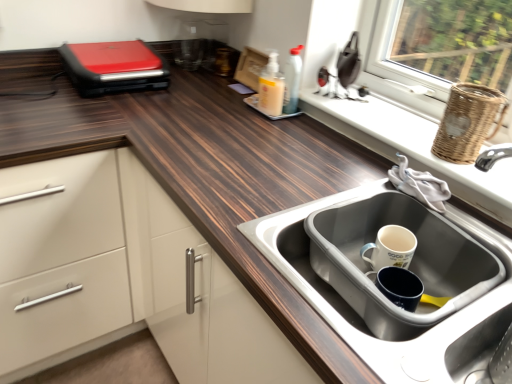
Question: From the image's perspective, is translucent plastic soap dispenser at center located above stainless steel sink at lower right?

Choices:
 (A) no
 (B) yes

Answer: (B)

Question: Are translucent plastic soap dispenser at center and stainless steel sink at lower right located far from each other?

Choices:
 (A) yes
 (B) no

Answer: (B)

Question: Is translucent plastic soap dispenser at center bigger than stainless steel sink at lower right?

Choices:
 (A) no
 (B) yes

Answer: (A)

Question: Is translucent plastic soap dispenser at center looking in the opposite direction of stainless steel sink at lower right?

Choices:
 (A) no
 (B) yes

Answer: (A)

Question: Does translucent plastic soap dispenser at center appear on the right side of stainless steel sink at lower right?

Choices:
 (A) yes
 (B) no

Answer: (B)

Question: From the image's perspective, is white wicker basket at right above or below white matte mug at sink?

Choices:
 (A) above
 (B) below

Answer: (A)

Question: Would you say white wicker basket at right is inside or outside white matte mug at sink?

Choices:
 (A) outside
 (B) inside

Answer: (A)

Question: Is point (487, 208) positioned closer to the camera than point (389, 251)?

Choices:
 (A) farther
 (B) closer

Answer: (A)

Question: Considering the relative positions of white wicker basket at right and white matte mug at sink in the image provided, is white wicker basket at right to the left or to the right of white matte mug at sink?

Choices:
 (A) right
 (B) left

Answer: (A)

Question: In terms of width, does stainless steel sink at lower right look wider or thinner when compared to translucent plastic soap dispenser at center?

Choices:
 (A) thin
 (B) wide

Answer: (B)

Question: From the image's perspective, is stainless steel sink at lower right above or below translucent plastic soap dispenser at center?

Choices:
 (A) above
 (B) below

Answer: (B)

Question: In the image, is stainless steel sink at lower right positioned in front of or behind translucent plastic soap dispenser at center?

Choices:
 (A) front
 (B) behind

Answer: (A)

Question: In terms of height, does stainless steel sink at lower right look taller or shorter compared to translucent plastic soap dispenser at center?

Choices:
 (A) short
 (B) tall

Answer: (A)

Question: Considering the positions of woven brown basket at upper right and red matte sandwich maker at upper left in the image, is woven brown basket at upper right bigger or smaller than red matte sandwich maker at upper left?

Choices:
 (A) big
 (B) small

Answer: (B)

Question: From a real-world perspective, is woven brown basket at upper right positioned above or below red matte sandwich maker at upper left?

Choices:
 (A) below
 (B) above

Answer: (B)